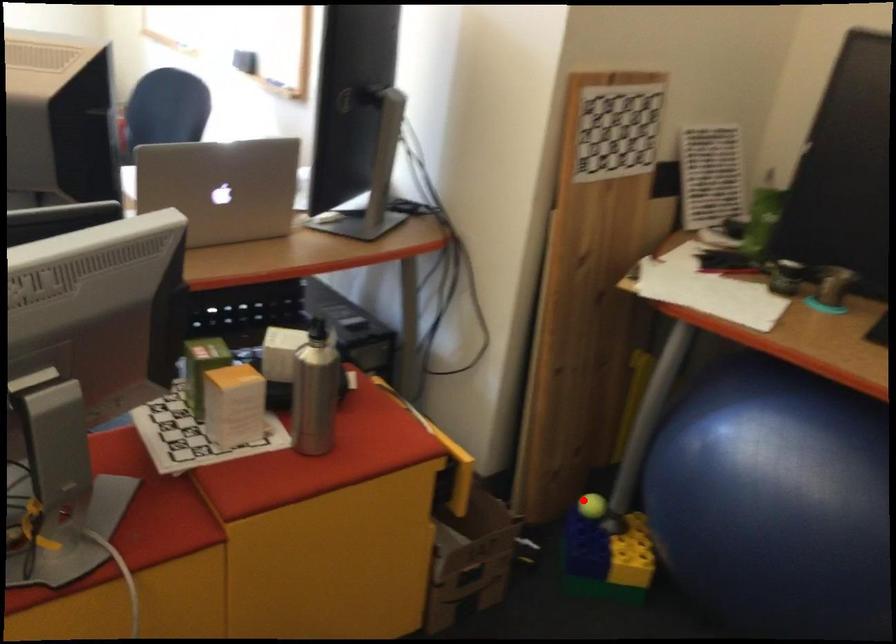
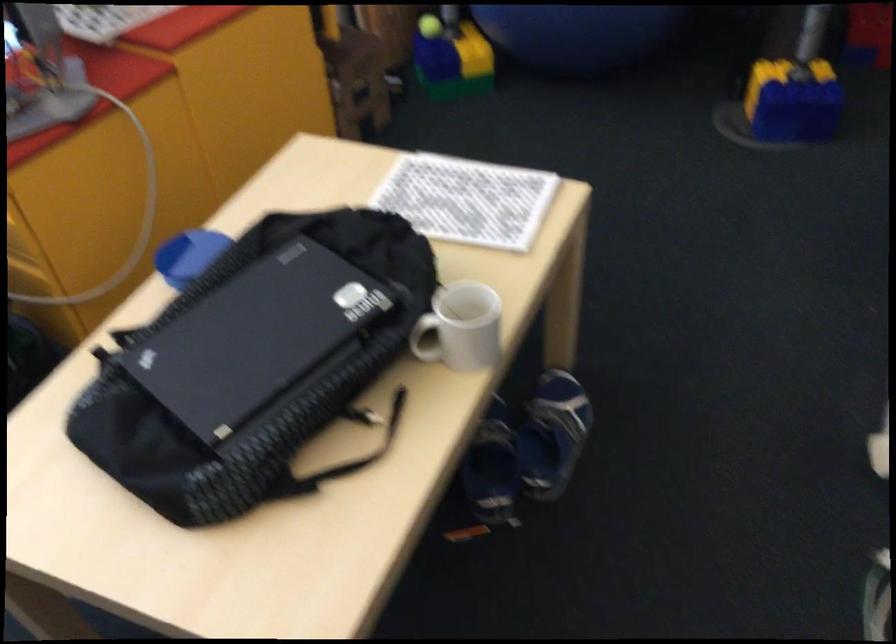
Question: I am providing you with two images of the same scene from different viewpoints. A red point is marked on the first image. At the location where the point appears in image 1, is it still visible in image 2?

Choices:
 (A) Yes
 (B) No

Answer: (A)